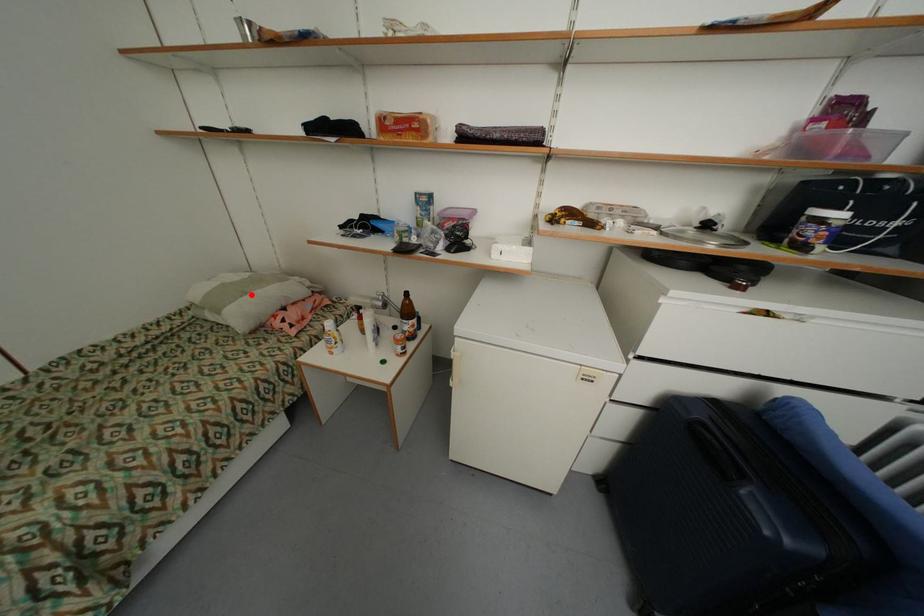
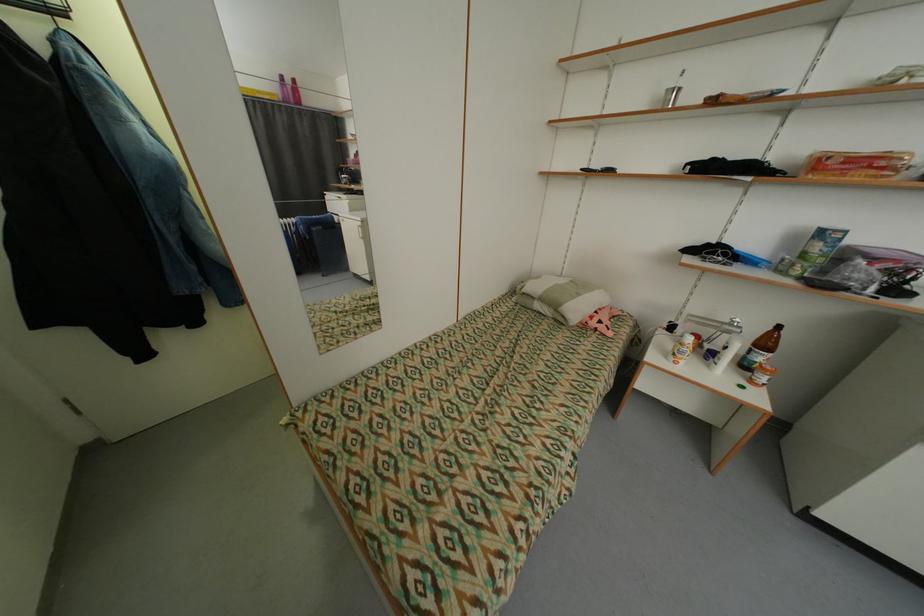
The point at the highlighted location is marked in the first image. Where is the corresponding point in the second image?

(585, 296)